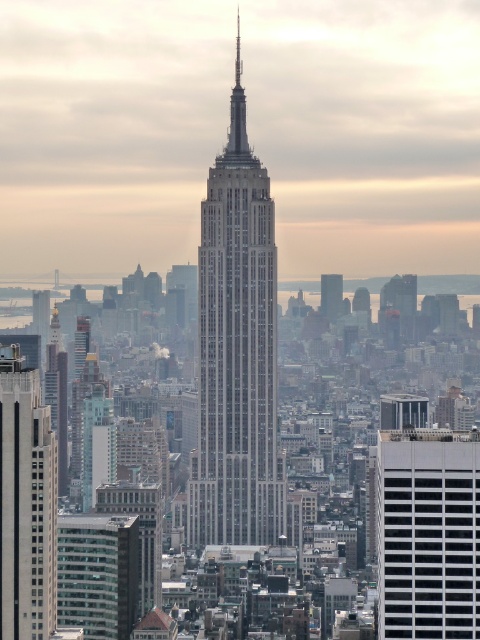
You are an urban planner analyzing the city layout. Given the white glass building at right and the gray stone skyscraper at left, which one has a greater width according to the scene?

The white glass building at right might be wider than gray stone skyscraper at left.

You are an architect analyzing the city skyline. You notice the white glass building at right and the gray stone skyscraper at center. Which of these two buildings is positioned lower in the image?

The white glass building at right is positioned lower than the gray stone skyscraper at center in the image.

You are standing at the observation deck of the Empire State Building and see two points in the distance. The first point is located at coordinates point (442, 476) and the second point is at point (330, 285). Which point is closer to you?

Point (330, 285) is closer to you because it is in front of point (442, 476).